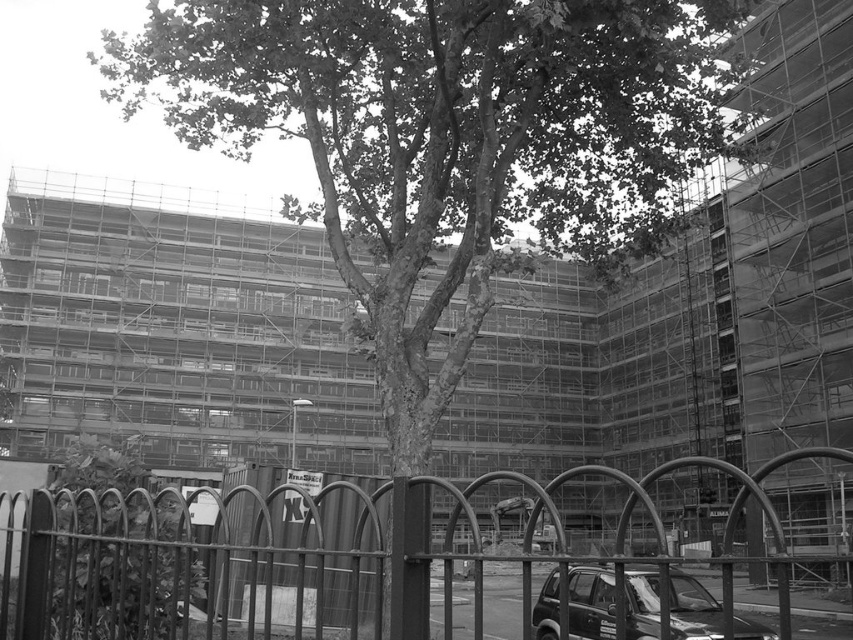
Question: Can you confirm if metallic wire fence at lower left is positioned above shiny black suv at lower right?

Choices:
 (A) yes
 (B) no

Answer: (B)

Question: Does metallic wire fence at lower left appear under shiny black suv at lower right?

Choices:
 (A) yes
 (B) no

Answer: (A)

Question: Which point is farther to the camera?

Choices:
 (A) metallic wire fence at lower left
 (B) shiny black suv at lower right

Answer: (B)

Question: Considering the relative positions of metallic wire fence at lower left and shiny black suv at lower right in the image provided, where is metallic wire fence at lower left located with respect to shiny black suv at lower right?

Choices:
 (A) above
 (B) below

Answer: (B)